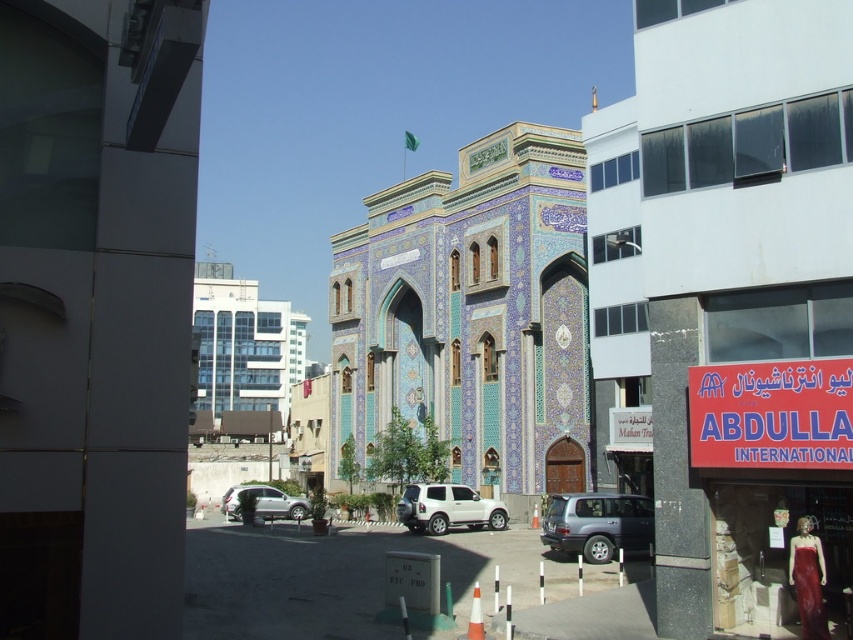
Question: Where is blue mosaic mosque at center located in relation to white matte suv at center in the image?

Choices:
 (A) below
 (B) above

Answer: (B)

Question: Which point is farther to the camera?

Choices:
 (A) white matte suv at center
 (B) metallic silver suv at center

Answer: (A)

Question: Can you confirm if metallic silver suv at center is thinner than white matte suv at center?

Choices:
 (A) yes
 (B) no

Answer: (A)

Question: Which point is closer to the camera?

Choices:
 (A) blue mosaic mosque at center
 (B) silver metallic suv at lower center
 (C) metallic silver suv at center

Answer: (C)

Question: Which object appears farthest from the camera in this image?

Choices:
 (A) white matte suv at center
 (B) metallic silver suv at center
 (C) blue mosaic mosque at center
 (D) silver metallic suv at lower center

Answer: (D)

Question: Can you confirm if blue mosaic mosque at center is smaller than silver metallic suv at lower center?

Choices:
 (A) no
 (B) yes

Answer: (A)